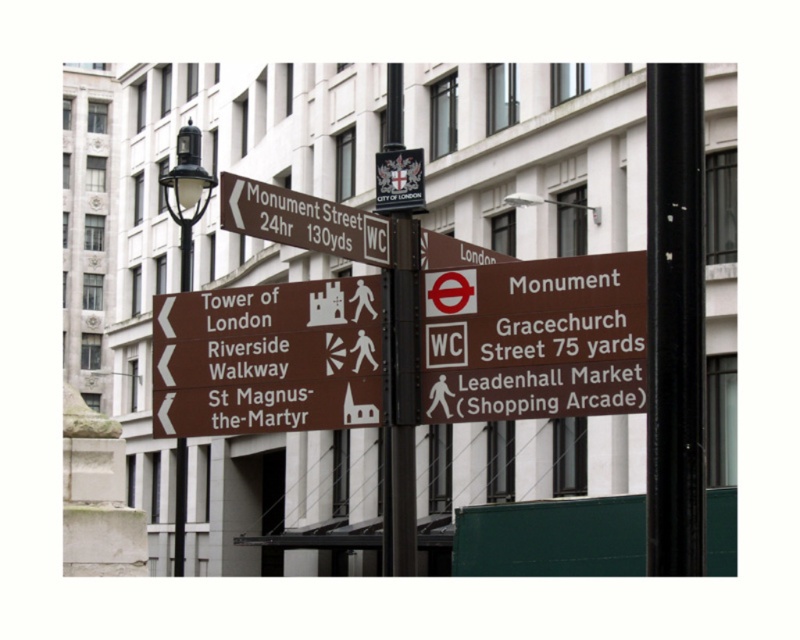
Question: Which point is closer to the camera?

Choices:
 (A) black metal pole at right
 (B) black polished metal streetlight at left

Answer: (A)

Question: Which point is farther from the camera taking this photo?

Choices:
 (A) (680, 460)
 (B) (297, 243)

Answer: (B)

Question: Is black metal pole at right closer to camera compared to brown matte sign at upper left?

Choices:
 (A) yes
 (B) no

Answer: (A)

Question: Observing the image, what is the correct spatial positioning of brown matte sign at upper left in reference to black polished metal streetlight at left?

Choices:
 (A) below
 (B) above

Answer: (B)

Question: Estimate the real-world distances between objects in this image. Which object is farther from the brown matte sign at upper left?

Choices:
 (A) black polished metal streetlight at left
 (B) black metal pole at right

Answer: (A)

Question: Does black metal pole at right have a smaller size compared to brown matte sign at upper left?

Choices:
 (A) no
 (B) yes

Answer: (A)